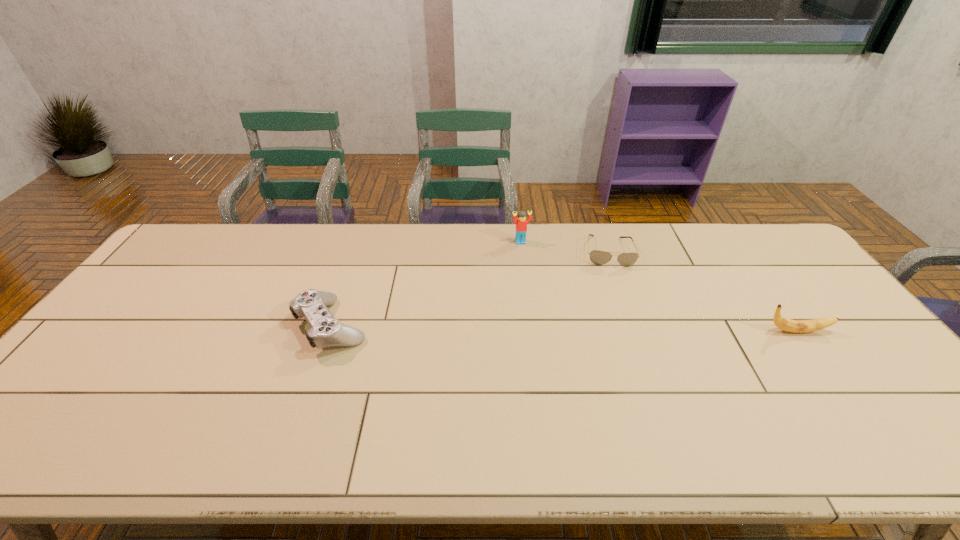
The image size is (960, 540). I want to click on free spot at the near edge of the desktop, so point(192,404).

Find the location of `blank area at the left edge`. blank area at the left edge is located at coordinates [x=116, y=372].

In the image, there is a desktop. Where is `free space at the right edge`? This screenshot has height=540, width=960. free space at the right edge is located at coordinates (850, 371).

I want to click on free space between the control and the third shortest object, so click(x=564, y=328).

Where is `vacant area that lies between the leftmost object and the second tallest object`? Image resolution: width=960 pixels, height=540 pixels. vacant area that lies between the leftmost object and the second tallest object is located at coordinates (564, 328).

I want to click on free space that is in between the tallest object and the control, so click(426, 284).

The width and height of the screenshot is (960, 540). I want to click on unoccupied area between the sunglasses and the third object from right to left, so 564,247.

Where is `empty space between the third object from left to right and the second shortest object`? This screenshot has height=540, width=960. empty space between the third object from left to right and the second shortest object is located at coordinates (469, 288).

At what (x,y) coordinates should I click in order to perform the action: click on vacant space in between the sunglasses and the banana. Please return your answer as a coordinate pair (x, y). This screenshot has width=960, height=540. Looking at the image, I should click on (702, 291).

This screenshot has height=540, width=960. What are the coordinates of `unoccupied position between the third object from left to right and the control` in the screenshot? It's located at (469, 288).